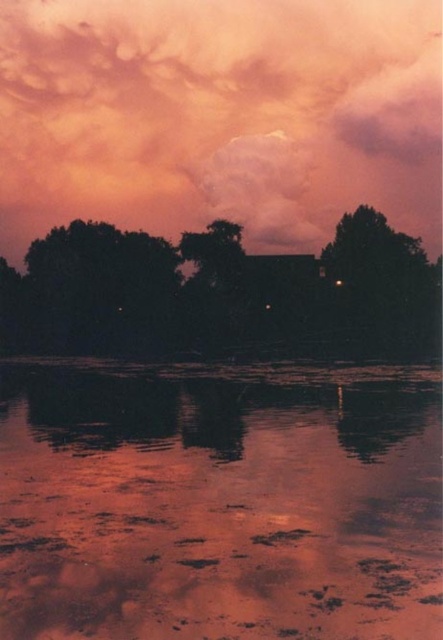
Question: Which is farther from the smooth reflective water at center?

Choices:
 (A) silhouette leafy tree at center
 (B) cloudy sky at upper center

Answer: (B)

Question: Is smooth reflective water at center closer to camera compared to cloudy sky at upper center?

Choices:
 (A) no
 (B) yes

Answer: (B)

Question: Considering the relative positions of smooth reflective water at center and cloudy sky at upper center in the image provided, where is smooth reflective water at center located with respect to cloudy sky at upper center?

Choices:
 (A) above
 (B) below

Answer: (B)

Question: Among these points, which one is farthest from the camera?

Choices:
 (A) (388, 26)
 (B) (86, 308)

Answer: (A)

Question: Estimate the real-world distances between objects in this image. Which object is closer to the cloudy sky at upper center?

Choices:
 (A) smooth reflective water at center
 (B) silhouette leafy tree at center

Answer: (B)

Question: In this image, where is smooth reflective water at center located relative to cloudy sky at upper center?

Choices:
 (A) left
 (B) right

Answer: (A)